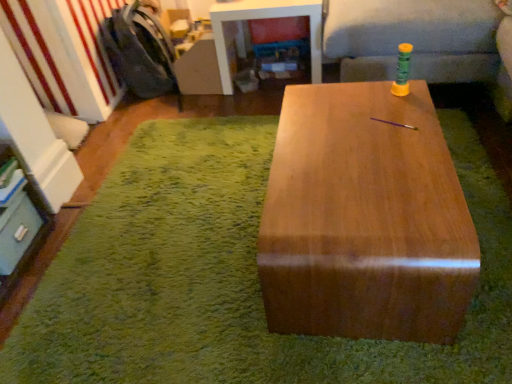
Question: Is satin wood table at center, arranged as the 1th table when ordered from the bottom, completely or partially outside of dark gray fabric armchair at left?

Choices:
 (A) yes
 (B) no

Answer: (A)

Question: Is satin wood table at center, arranged as the 1th table when ordered from the bottom, oriented towards dark gray fabric armchair at left?

Choices:
 (A) yes
 (B) no

Answer: (B)

Question: Is satin wood table at center, acting as the 2th table starting from the top, to the right of dark gray fabric armchair at left from the viewer's perspective?

Choices:
 (A) no
 (B) yes

Answer: (B)

Question: Considering the relative sizes of satin wood table at center, acting as the 2th table starting from the top, and dark gray fabric armchair at left in the image provided, is satin wood table at center, acting as the 2th table starting from the top, thinner than dark gray fabric armchair at left?

Choices:
 (A) yes
 (B) no

Answer: (B)

Question: Is satin wood table at center, the 1th table when ordered from front to back, bigger than dark gray fabric armchair at left?

Choices:
 (A) no
 (B) yes

Answer: (B)

Question: Is dark gray fabric armchair at left surrounded by satin wood table at center, arranged as the 1th table when ordered from the bottom?

Choices:
 (A) no
 (B) yes

Answer: (A)

Question: Is wooden table at center looking in the opposite direction of satin wood table at center, the 1th table when ordered from front to back?

Choices:
 (A) no
 (B) yes

Answer: (A)

Question: Is the position of wooden table at center less distant than that of satin wood table at center, acting as the 2th table starting from the top?

Choices:
 (A) no
 (B) yes

Answer: (A)

Question: Does wooden table at center turn towards satin wood table at center, the 1th table when ordered from front to back?

Choices:
 (A) yes
 (B) no

Answer: (B)

Question: Considering the relative sizes of wooden table at center and satin wood table at center, acting as the 2th table starting from the top, in the image provided, is wooden table at center thinner than satin wood table at center, acting as the 2th table starting from the top,?

Choices:
 (A) yes
 (B) no

Answer: (B)

Question: Is wooden table at center wider than satin wood table at center, acting as the 2th table starting from the top?

Choices:
 (A) yes
 (B) no

Answer: (A)

Question: Is wooden table at center taller than satin wood table at center, arranged as the 1th table when ordered from the bottom?

Choices:
 (A) no
 (B) yes

Answer: (A)

Question: Does matte gray drawer at lower left have a larger size compared to dark gray fabric armchair at left?

Choices:
 (A) no
 (B) yes

Answer: (A)